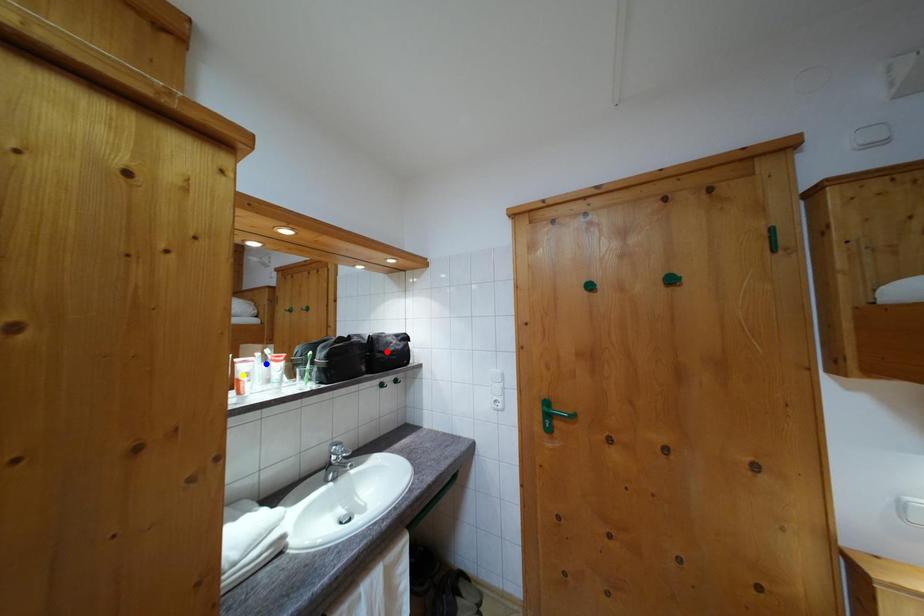
Order these from nearest to farthest:
blue point, yellow point, red point

yellow point, blue point, red point